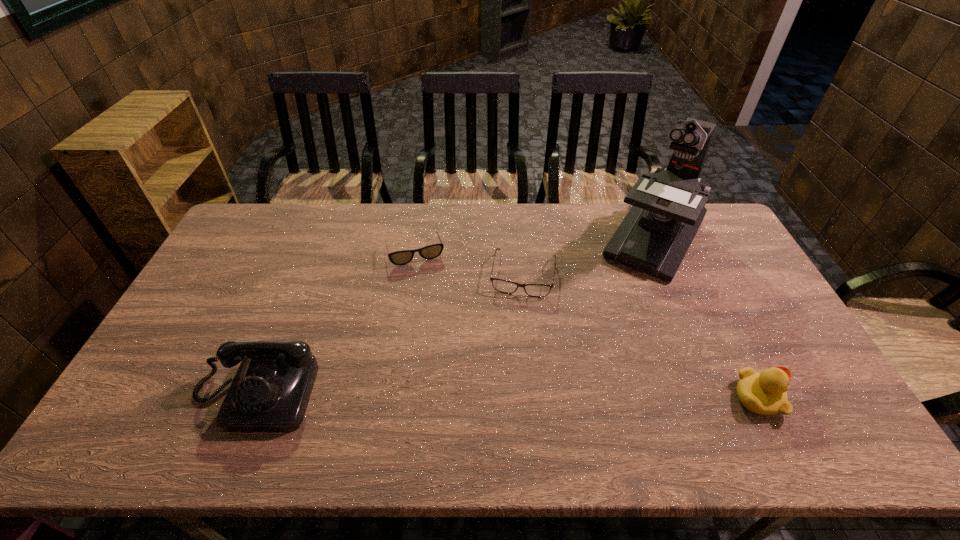
The width and height of the screenshot is (960, 540). I want to click on vacant space located 0.170m through the eyepieces of the tallest object, so click(x=614, y=308).

Locate an element on the screen. The height and width of the screenshot is (540, 960). free point located 0.400m through the eyepieces of the tallest object is located at coordinates (583, 361).

The height and width of the screenshot is (540, 960). I want to click on blank area located through the eyepieces of the tallest object, so click(619, 300).

The width and height of the screenshot is (960, 540). I want to click on free space located 0.310m on the front-facing side of the sunglasses, so click(444, 339).

This screenshot has width=960, height=540. Find the location of `free region located 0.140m on the front-facing side of the sunglasses`. free region located 0.140m on the front-facing side of the sunglasses is located at coordinates (431, 297).

Identify the location of blank area located on the front-facing side of the sunglasses. This screenshot has width=960, height=540. (429, 292).

The height and width of the screenshot is (540, 960). I want to click on microscope at the far edge, so click(668, 208).

The image size is (960, 540). Identify the location of sunglasses present at the far edge. (403, 257).

What are the coordinates of `telephone at the near edge` in the screenshot? It's located at (270, 391).

Where is `duckling located at the near edge`? Image resolution: width=960 pixels, height=540 pixels. duckling located at the near edge is located at coordinates (764, 393).